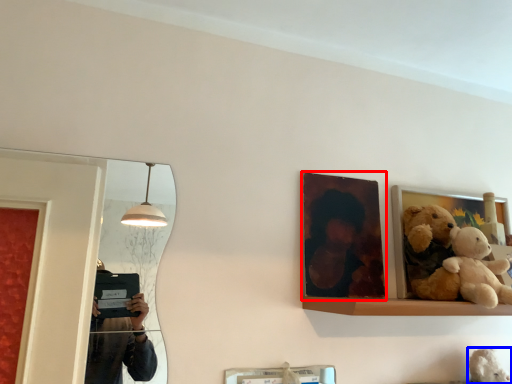
Question: Which object is closer to the camera taking this photo, picture frame (highlighted by a red box) or teddy (highlighted by a blue box)?

Choices:
 (A) picture frame
 (B) teddy

Answer: (B)